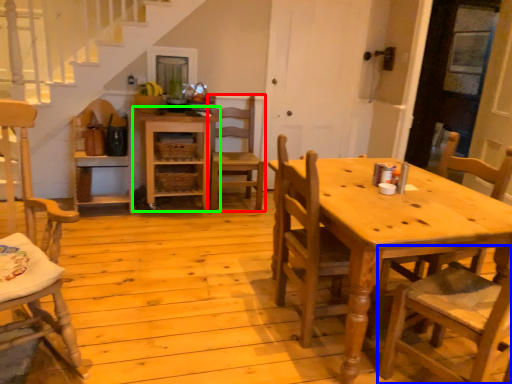
Question: Based on their relative distances, which object is nearer to chair (highlighted by a red box)? Choose from chair (highlighted by a blue box) and shelf (highlighted by a green box).

Choices:
 (A) chair
 (B) shelf

Answer: (B)